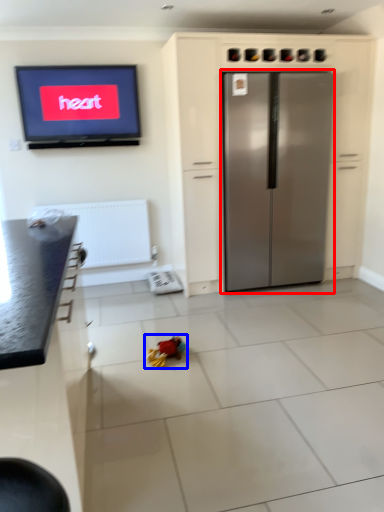
Question: Which point is further to the camera, refrigerator (highlighted by a red box) or toy (highlighted by a blue box)?

Choices:
 (A) refrigerator
 (B) toy

Answer: (A)